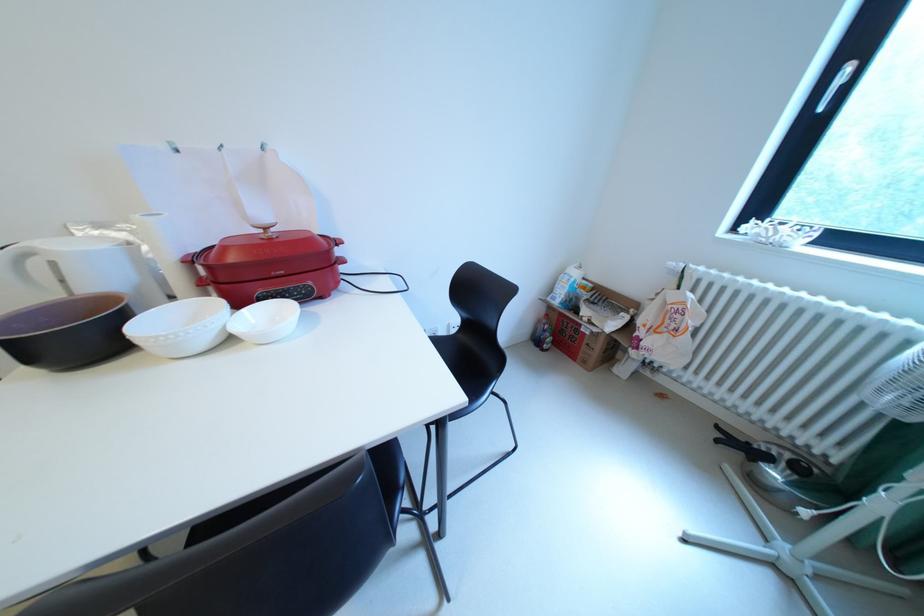
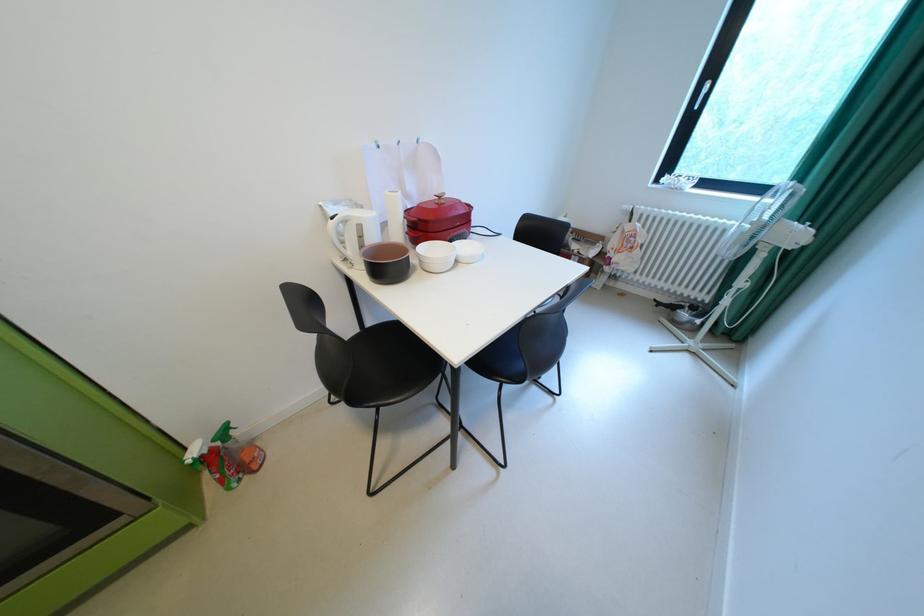
Find the pixel in the second image that matches (x=65, y=265) in the first image.

(370, 227)